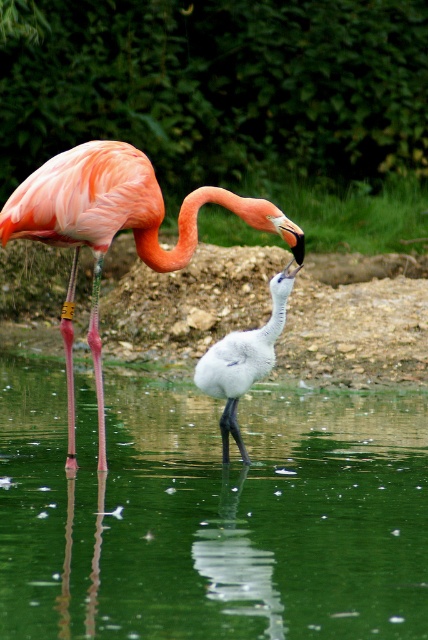
Which is behind, point (23, 216) or point (237, 374)?

The point (237, 374) is more distant.

Where is `matte pink flamingo at upper left`? The width and height of the screenshot is (428, 640). matte pink flamingo at upper left is located at coordinates (115, 230).

Can you confirm if green reflective water at center is positioned to the left of white feathered bird at center?

Correct, you'll find green reflective water at center to the left of white feathered bird at center.

Does green reflective water at center have a larger size compared to white feathered bird at center?

Indeed, green reflective water at center has a larger size compared to white feathered bird at center.

Find the location of `green reflective water at center`. green reflective water at center is located at coordinates (211, 515).

Between green reflective water at center and matte pink flamingo at upper left, which one is positioned lower?

green reflective water at center is below.

Does green reflective water at center have a lesser width compared to matte pink flamingo at upper left?

No, green reflective water at center is not thinner than matte pink flamingo at upper left.

The height and width of the screenshot is (640, 428). Identify the location of green reflective water at center. (211, 515).